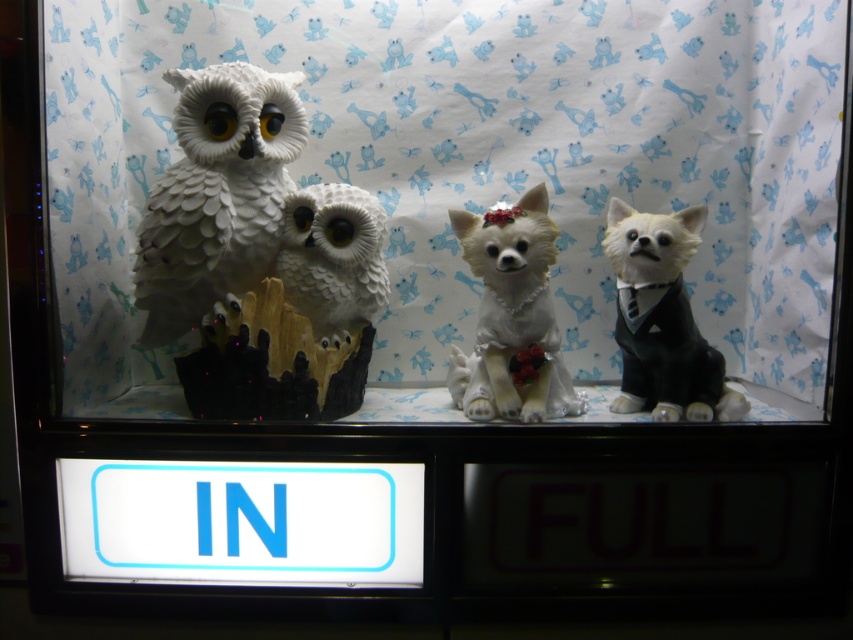
Can you confirm if white glossy owl at left is shorter than white porcelain chihuahua at center?

In fact, white glossy owl at left may be taller than white porcelain chihuahua at center.

Is point (149, 340) farther from viewer compared to point (509, 333)?

Yes, point (149, 340) is behind point (509, 333).

This screenshot has height=640, width=853. I want to click on white glossy owl at left, so click(218, 195).

Is white glossy owl at left above white matte owl at center?

Yes.

Is point (189, 248) behind point (363, 269)?

No, (189, 248) is closer to viewer.

Find the location of a particular element. Image resolution: width=853 pixels, height=640 pixels. white glossy owl at left is located at coordinates (218, 195).

Between point (555, 228) and point (344, 205), which one is positioned behind?

The point (555, 228) is behind.

Is white porcelain chihuahua at center further to the viewer compared to white matte owl at center?

No, it is in front of white matte owl at center.

What are the coordinates of `white porcelain chihuahua at center` in the screenshot? It's located at (512, 316).

Where is `white porcelain chihuahua at center`? white porcelain chihuahua at center is located at coordinates (512, 316).